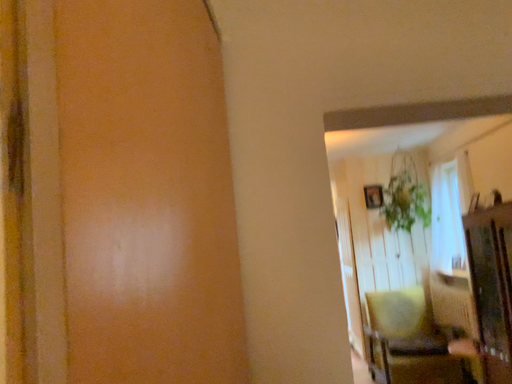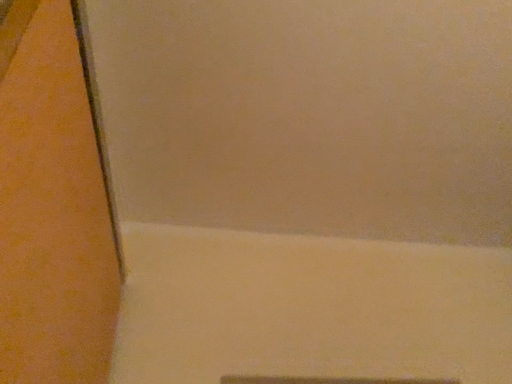
Question: How did the camera likely rotate when shooting the video?

Choices:
 (A) rotated upward
 (B) rotated downward

Answer: (A)